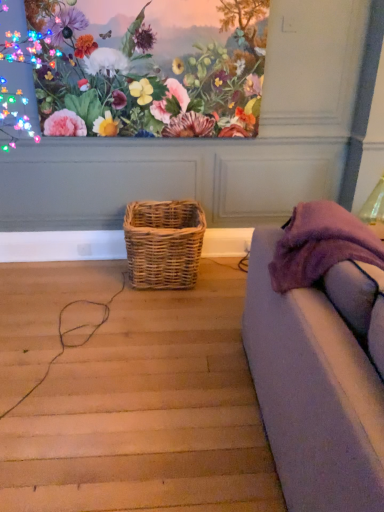
Question: Is woven natural basket at center inside or outside of matte floral painting at upper center?

Choices:
 (A) inside
 (B) outside

Answer: (B)

Question: Relative to matte floral painting at upper center, is woven natural basket at center in front or behind?

Choices:
 (A) front
 (B) behind

Answer: (B)

Question: Considering the real-world distances, which object is closest to the woven natural basket at center?

Choices:
 (A) purple fabric couch at right
 (B) matte floral painting at upper center

Answer: (B)

Question: Which object is the farthest from the matte floral painting at upper center?

Choices:
 (A) woven natural basket at center
 (B) purple fabric couch at right

Answer: (B)